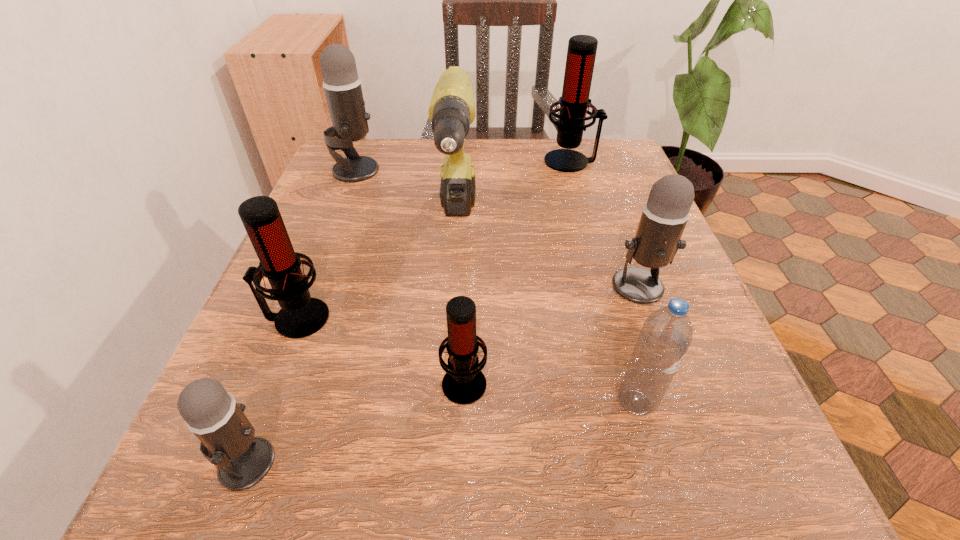
Identify the location of the nearest red microphone. This screenshot has width=960, height=540. (464, 383).

This screenshot has height=540, width=960. In order to click on the nearest object in this screenshot , I will do `click(227, 438)`.

Locate an element on the screen. the nearest microphone is located at coordinates (227, 438).

Where is `free space located on the front of the biggest red microphone`? The image size is (960, 540). free space located on the front of the biggest red microphone is located at coordinates (597, 252).

Identify the location of free space located 0.160m on the right of the farthest gray microphone. (448, 170).

Find the location of a particular element. This screenshot has width=960, height=540. free space located 0.310m on the handle side of the drill is located at coordinates (444, 440).

The width and height of the screenshot is (960, 540). I want to click on free space located 0.380m on the right of the second biggest red microphone, so click(569, 318).

This screenshot has height=540, width=960. In order to click on vacant space located 0.290m on the front of the second biggest gray microphone in this screenshot , I will do `click(712, 490)`.

I want to click on free space located 0.260m on the back of the water bottle, so click(596, 260).

Where is `vacant space located 0.160m on the back of the nearest red microphone`? The height and width of the screenshot is (540, 960). vacant space located 0.160m on the back of the nearest red microphone is located at coordinates (468, 281).